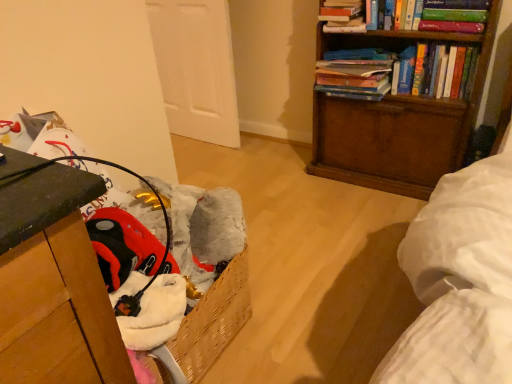
This screenshot has height=384, width=512. I want to click on free spot above hardcover books at upper right, the third book from the left (from a real-world perspective), so click(x=435, y=41).